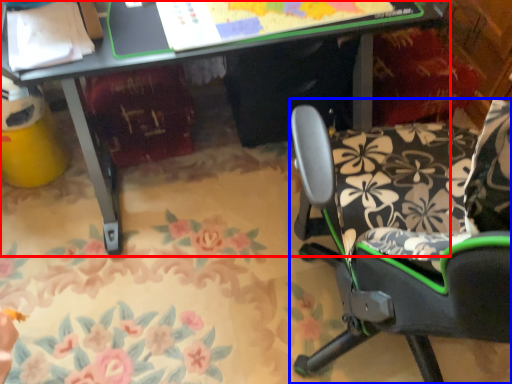
Question: Among these objects, which one is farthest to the camera, desk (highlighted by a red box) or chair (highlighted by a blue box)?

Choices:
 (A) desk
 (B) chair

Answer: (A)